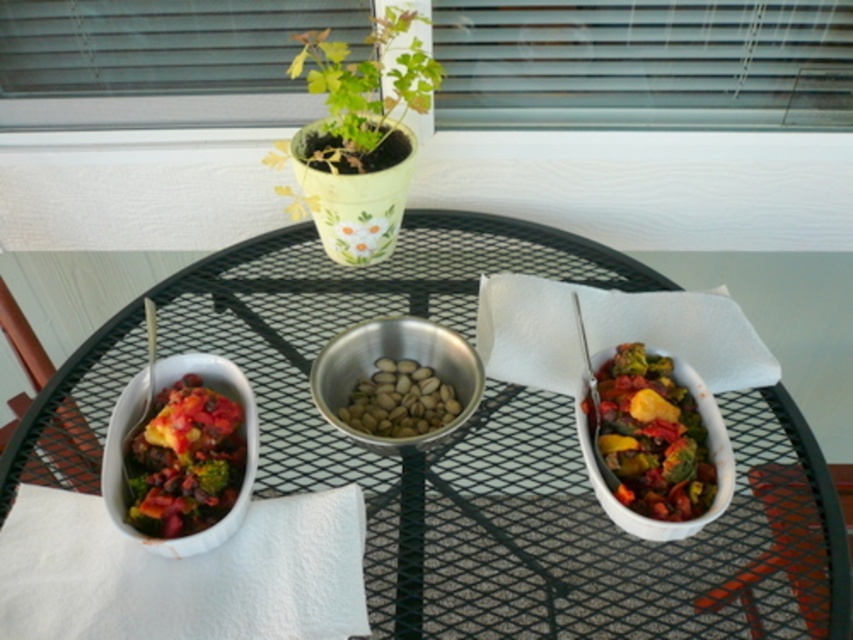
Does point (831, 589) come behind point (467, 387)?

That is False.

Can you confirm if metallic mesh table at center is smaller than metallic silver bowl at center?

Incorrect, metallic mesh table at center is not smaller in size than metallic silver bowl at center.

Where is `metallic mesh table at center`? The height and width of the screenshot is (640, 853). metallic mesh table at center is located at coordinates (469, 452).

Who is higher up, green matte plant at upper center or metallic silver bowl at center?

green matte plant at upper center

Can you confirm if green matte plant at upper center is shorter than metallic silver bowl at center?

No.

Describe the element at coordinates (366, 84) in the screenshot. I see `green matte plant at upper center` at that location.

Identify the location of green matte plant at upper center. (x=366, y=84).

Consider the image. Does green matte plant at upper center appear under white matte bowl at right?

Actually, green matte plant at upper center is above white matte bowl at right.

Which is below, green matte plant at upper center or white matte bowl at right?

Positioned lower is white matte bowl at right.

In order to click on green matte plant at upper center in this screenshot , I will do `click(366, 84)`.